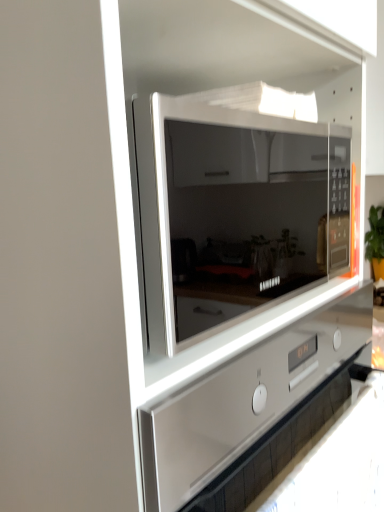
The image size is (384, 512). Describe the element at coordinates (233, 212) in the screenshot. I see `sleek glass microwave at center` at that location.

The height and width of the screenshot is (512, 384). What are the coordinates of `sleek glass microwave at center` in the screenshot? It's located at [233, 212].

Measure the distance between point (194, 119) and camera.

They are 58.90 centimeters apart.

At what (x,y) coordinates should I click in order to perform the action: click on satin white oven at center. Please return your answer as a coordinate pair (x, y). This screenshot has width=384, height=512. Looking at the image, I should click on (253, 411).

What do you see at coordinates (253, 411) in the screenshot? I see `satin white oven at center` at bounding box center [253, 411].

Where is `sleek glass microwave at center`? sleek glass microwave at center is located at coordinates (233, 212).

Can you confirm if sleek glass microwave at center is positioned to the right of satin white oven at center?

Indeed, sleek glass microwave at center is positioned on the right side of satin white oven at center.

Is sleek glass microwave at center further to the viewer compared to satin white oven at center?

Yes, sleek glass microwave at center is further from the viewer.

Considering the positions of points (153, 259) and (283, 349), is point (153, 259) closer to camera compared to point (283, 349)?

Yes, it is in front of point (283, 349).

From the image's perspective, is sleek glass microwave at center above satin white oven at center?

Yes, from the image's perspective, sleek glass microwave at center is on top of satin white oven at center.

From a real-world perspective, is sleek glass microwave at center positioned above or below satin white oven at center?

Clearly, from a real-world perspective, sleek glass microwave at center is above satin white oven at center.

Is sleek glass microwave at center wider or thinner than satin white oven at center?

In the image, sleek glass microwave at center appears to be more narrow than satin white oven at center.

Considering the relative sizes of sleek glass microwave at center and satin white oven at center in the image provided, is sleek glass microwave at center shorter than satin white oven at center?

Yes, sleek glass microwave at center is shorter than satin white oven at center.

Is sleek glass microwave at center smaller than satin white oven at center?

Indeed, sleek glass microwave at center has a smaller size compared to satin white oven at center.

Can we say sleek glass microwave at center lies outside satin white oven at center?

Yes, sleek glass microwave at center is located beyond the bounds of satin white oven at center.

Is sleek glass microwave at center with satin white oven at center?

No, sleek glass microwave at center is not making contact with satin white oven at center.

Is satin white oven at center at the back of sleek glass microwave at center?

sleek glass microwave at center is not turned away from satin white oven at center.

Can you tell me how much sleek glass microwave at center and satin white oven at center differ in facing direction?

0.814 degrees.

In order to click on home appliance in front of the sleek glass microwave at center in this screenshot , I will do `click(253, 411)`.

Considering the relative positions of satin white oven at center and sleek glass microwave at center in the image provided, is satin white oven at center to the right of sleek glass microwave at center from the viewer's perspective?

Incorrect, satin white oven at center is not on the right side of sleek glass microwave at center.

Relative to sleek glass microwave at center, is satin white oven at center in front or behind?

satin white oven at center is in front of sleek glass microwave at center.

Considering the positions of point (201, 379) and point (332, 228), is point (201, 379) closer or farther from the camera than point (332, 228)?

Point (201, 379) appears to be closer to the viewer than point (332, 228).

Consider the image. From the image's perspective, is satin white oven at center on sleek glass microwave at center?

No, from the image's perspective, satin white oven at center is not on top of sleek glass microwave at center.

From a real-world perspective, is satin white oven at center above or below sleek glass microwave at center?

From a real-world perspective, satin white oven at center is physically below sleek glass microwave at center.

Does satin white oven at center have a greater width compared to sleek glass microwave at center?

Yes, satin white oven at center is wider than sleek glass microwave at center.

Does satin white oven at center have a lesser height compared to sleek glass microwave at center?

No, satin white oven at center is not shorter than sleek glass microwave at center.

Can you confirm if satin white oven at center is smaller than sleek glass microwave at center?

No.

Consider the image. Is sleek glass microwave at center surrounded by satin white oven at center?

Actually, sleek glass microwave at center is outside satin white oven at center.

Based on the photo, are satin white oven at center and sleek glass microwave at center making contact?

No, satin white oven at center is not with sleek glass microwave at center.

Could you tell me if satin white oven at center is facing sleek glass microwave at center?

No, satin white oven at center is not turned towards sleek glass microwave at center.

How different are the orientations of satin white oven at center and sleek glass microwave at center in degrees?

The facing directions of satin white oven at center and sleek glass microwave at center are 0.814 degrees apart.

Where is `home appliance that is under the sleek glass microwave at center (from a real-world perspective)`? The width and height of the screenshot is (384, 512). home appliance that is under the sleek glass microwave at center (from a real-world perspective) is located at coordinates (253, 411).

The height and width of the screenshot is (512, 384). There is a satin white oven at center. In order to click on microwave oven above it (from a real-world perspective) in this screenshot , I will do pyautogui.click(x=233, y=212).

This screenshot has width=384, height=512. What are the coordinates of `microwave oven above the satin white oven at center (from the image's perspective)` in the screenshot? It's located at (233, 212).